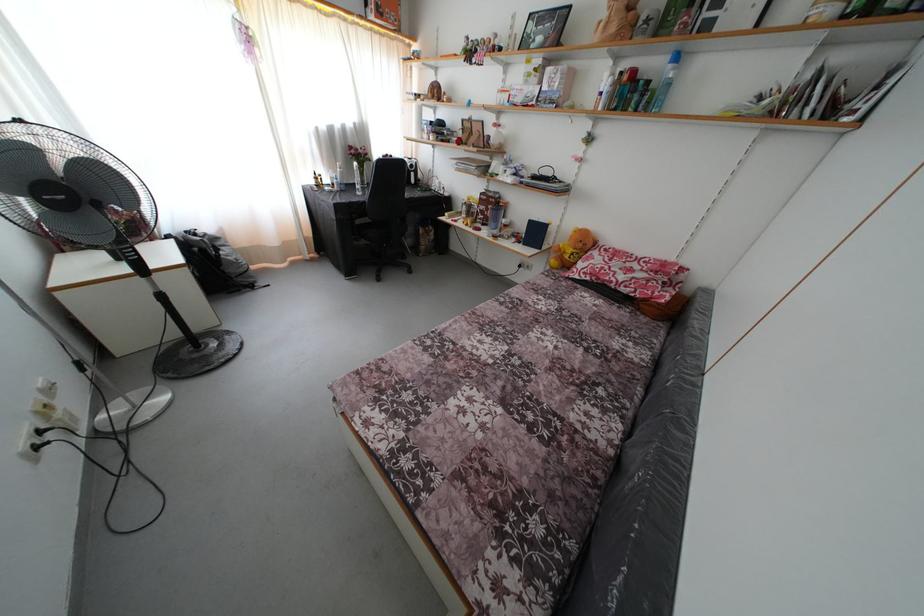
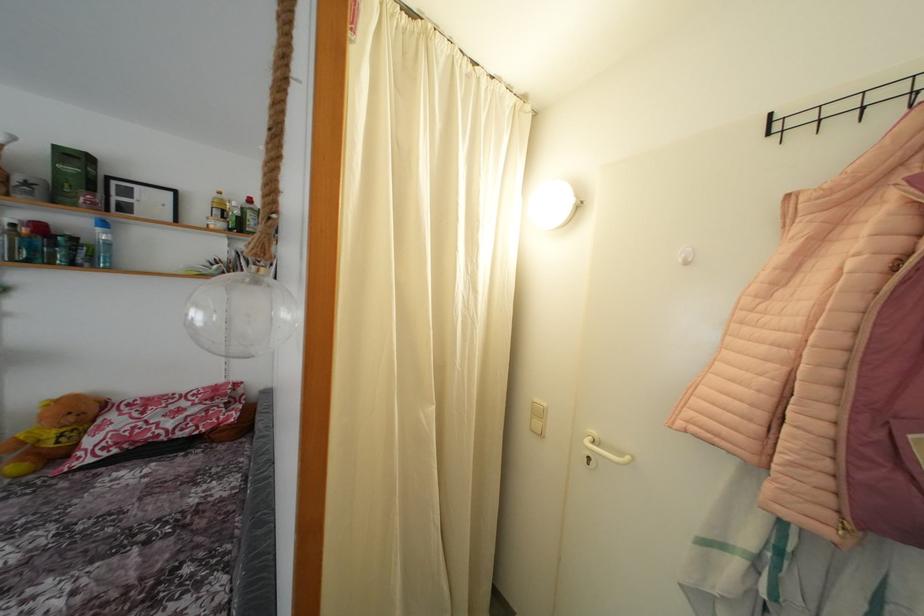
In the second image, find the point that corresponds to pixel 585 251 in the first image.

(77, 424)